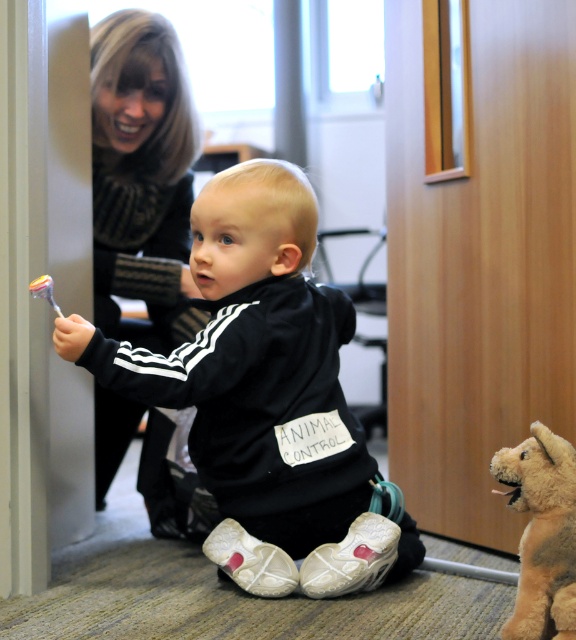
Question: Among these points, which one is farthest from the camera?

Choices:
 (A) (543, 570)
 (B) (263, 205)
 (C) (54, 307)

Answer: (B)

Question: Can you confirm if black matte jacket at center is positioned to the right of blonde hair at upper left?

Choices:
 (A) yes
 (B) no

Answer: (A)

Question: Which object is farther from the camera taking this photo?

Choices:
 (A) blonde hair at upper left
 (B) black matte jacket at center

Answer: (A)

Question: Which point is closer to the camera?

Choices:
 (A) (529, 586)
 (B) (285, 378)
 (C) (165, 52)
 (D) (56, 307)

Answer: (A)

Question: Observing the image, what is the correct spatial positioning of black matte jacket at center in reference to blonde hair at upper left?

Choices:
 (A) left
 (B) right

Answer: (B)

Question: Is the position of blonde hair at upper left more distant than that of fuzzy beige stuffed animal at lower right?

Choices:
 (A) yes
 (B) no

Answer: (A)